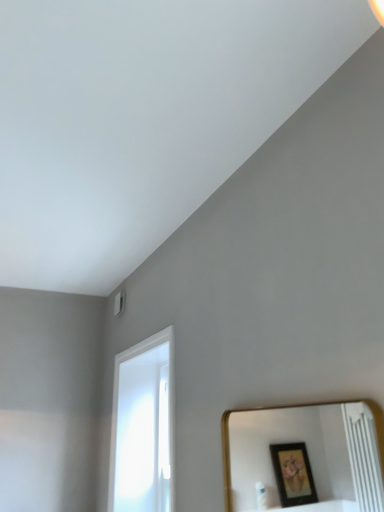
Question: From the image's perspective, is gold-framed mirror at lower right on white glossy door at lower left?

Choices:
 (A) yes
 (B) no

Answer: (A)

Question: From a real-world perspective, is gold-framed mirror at lower right below white glossy door at lower left?

Choices:
 (A) yes
 (B) no

Answer: (A)

Question: Is gold-framed mirror at lower right to the left of white glossy door at lower left from the viewer's perspective?

Choices:
 (A) no
 (B) yes

Answer: (A)

Question: Does gold-framed mirror at lower right have a greater height compared to white glossy door at lower left?

Choices:
 (A) no
 (B) yes

Answer: (A)

Question: Is gold-framed mirror at lower right thinner than white glossy door at lower left?

Choices:
 (A) yes
 (B) no

Answer: (A)

Question: Is gold-framed mirror at lower right closer to the viewer compared to white glossy door at lower left?

Choices:
 (A) no
 (B) yes

Answer: (B)

Question: Does white glossy door at lower left have a larger size compared to gold-framed mirror at lower right?

Choices:
 (A) yes
 (B) no

Answer: (A)

Question: Can you confirm if white glossy door at lower left is positioned to the left of gold-framed mirror at lower right?

Choices:
 (A) yes
 (B) no

Answer: (A)

Question: Is white glossy door at lower left facing away from gold-framed mirror at lower right?

Choices:
 (A) no
 (B) yes

Answer: (A)

Question: From the image's perspective, is white glossy door at lower left located beneath gold-framed mirror at lower right?

Choices:
 (A) no
 (B) yes

Answer: (B)

Question: Is white glossy door at lower left next to gold-framed mirror at lower right and touching it?

Choices:
 (A) yes
 (B) no

Answer: (B)

Question: Is white glossy door at lower left smaller than gold-framed mirror at lower right?

Choices:
 (A) no
 (B) yes

Answer: (A)

Question: Is point (369, 487) positioned closer to the camera than point (162, 442)?

Choices:
 (A) closer
 (B) farther

Answer: (B)